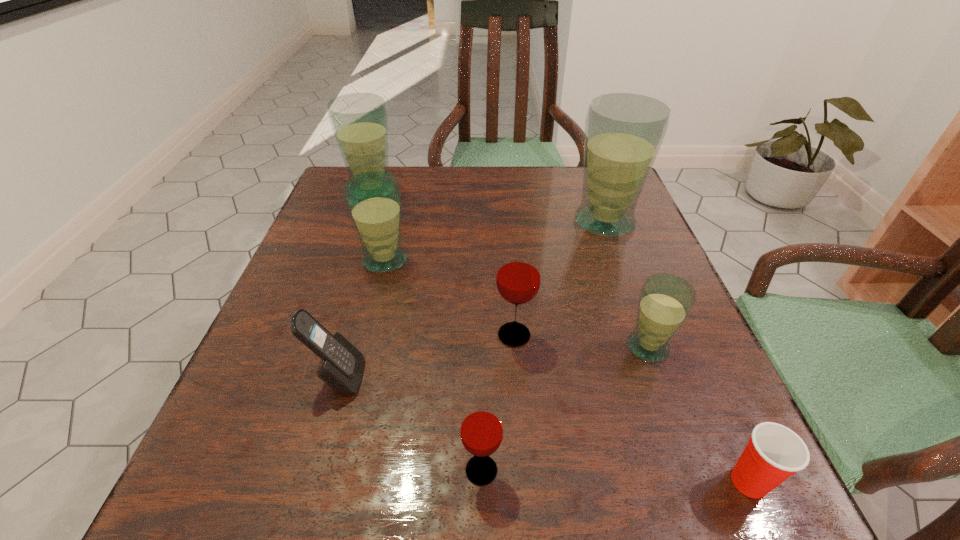
This screenshot has height=540, width=960. What are the coordinates of `free location that satisfies the following two spatial constraints: 1. on the back side of the nearest blue glass; 2. on the left side of the biggest blue glass` in the screenshot? It's located at (603, 222).

I want to click on free space in the image that satisfies the following two spatial constraints: 1. on the front-facing side of the cellular telephone; 2. on the back side of the Dixie cup, so click(309, 481).

This screenshot has height=540, width=960. What are the coordinates of `free point that satisfies the following two spatial constraints: 1. on the front side of the tallest glass; 2. on the right side of the red Dixie cup` in the screenshot? It's located at (698, 481).

Find the location of a particular element. vacant area that satisfies the following two spatial constraints: 1. on the front-facing side of the cellular telephone; 2. on the left side of the nearer red glass is located at coordinates (312, 470).

Locate an element on the screen. free space in the image that satisfies the following two spatial constraints: 1. on the front-facing side of the cellular telephone; 2. on the left side of the red Dixie cup is located at coordinates (309, 481).